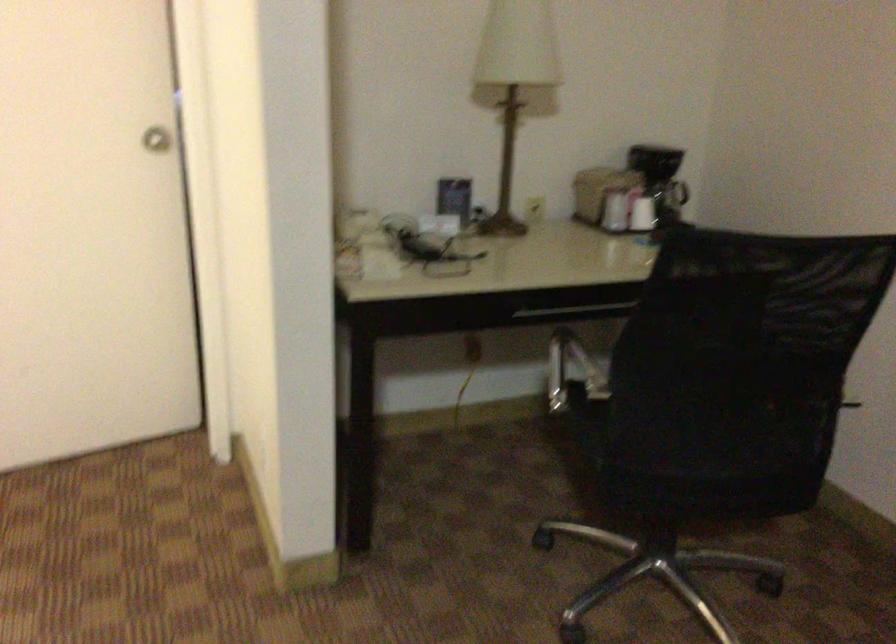
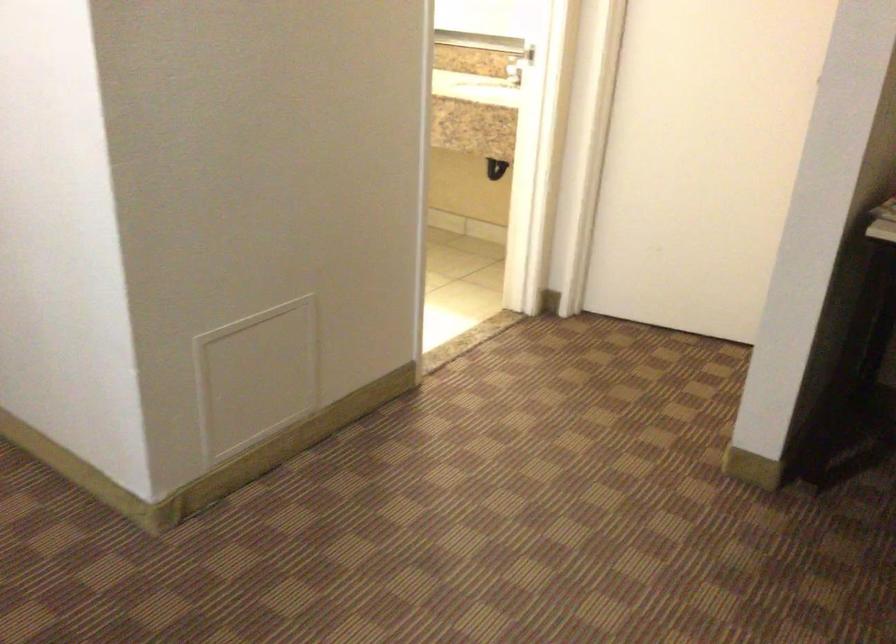
Question: How did the camera likely rotate?

Choices:
 (A) Left
 (B) Right
 (C) Up
 (D) Down

Answer: (A)